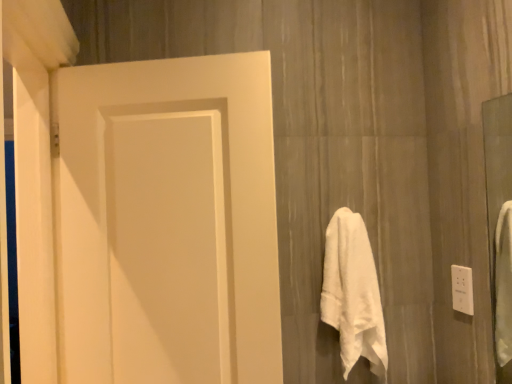
Question: Is white soft towel at center-right oriented towards white plastic outlet at right?

Choices:
 (A) yes
 (B) no

Answer: (B)

Question: Is white soft towel at center-right to the left of white plastic outlet at right from the viewer's perspective?

Choices:
 (A) yes
 (B) no

Answer: (A)

Question: From the image's perspective, is white soft towel at center-right located beneath white plastic outlet at right?

Choices:
 (A) no
 (B) yes

Answer: (B)

Question: From a real-world perspective, is white soft towel at center-right positioned over white plastic outlet at right based on gravity?

Choices:
 (A) no
 (B) yes

Answer: (A)

Question: Considering the relative sizes of white soft towel at center-right and white plastic outlet at right in the image provided, is white soft towel at center-right taller than white plastic outlet at right?

Choices:
 (A) yes
 (B) no

Answer: (A)

Question: Is white soft towel at center-right in front of or behind white plastic outlet at right in the image?

Choices:
 (A) behind
 (B) front

Answer: (B)

Question: From the image's perspective, is white soft towel at center-right positioned above or below white plastic outlet at right?

Choices:
 (A) above
 (B) below

Answer: (B)

Question: Considering the positions of white soft towel at center-right and white plastic outlet at right in the image, is white soft towel at center-right wider or thinner than white plastic outlet at right?

Choices:
 (A) thin
 (B) wide

Answer: (B)

Question: Visually, is white soft towel at center-right positioned to the left or to the right of white plastic outlet at right?

Choices:
 (A) right
 (B) left

Answer: (B)

Question: Looking at the image, does white plastic outlet at right seem bigger or smaller compared to matte white door at left?

Choices:
 (A) small
 (B) big

Answer: (A)

Question: Looking at their shapes, would you say white plastic outlet at right is wider or thinner than matte white door at left?

Choices:
 (A) wide
 (B) thin

Answer: (B)

Question: Considering the positions of point coord(471,281) and point coord(229,59), is point coord(471,281) closer or farther from the camera than point coord(229,59)?

Choices:
 (A) farther
 (B) closer

Answer: (A)

Question: Based on their positions, is white plastic outlet at right located to the left or right of matte white door at left?

Choices:
 (A) right
 (B) left

Answer: (A)

Question: In terms of height, does white plastic outlet at right look taller or shorter compared to white soft towel at center-right?

Choices:
 (A) short
 (B) tall

Answer: (A)

Question: Is white plastic outlet at right in front of or behind white soft towel at center-right in the image?

Choices:
 (A) front
 (B) behind

Answer: (B)